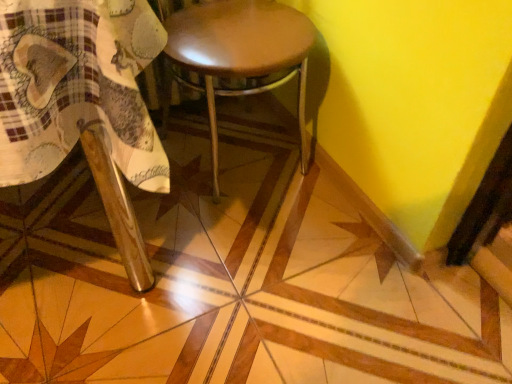
This screenshot has width=512, height=384. Find the location of `free space in front of shiny brown stool at center`. free space in front of shiny brown stool at center is located at coordinates (281, 258).